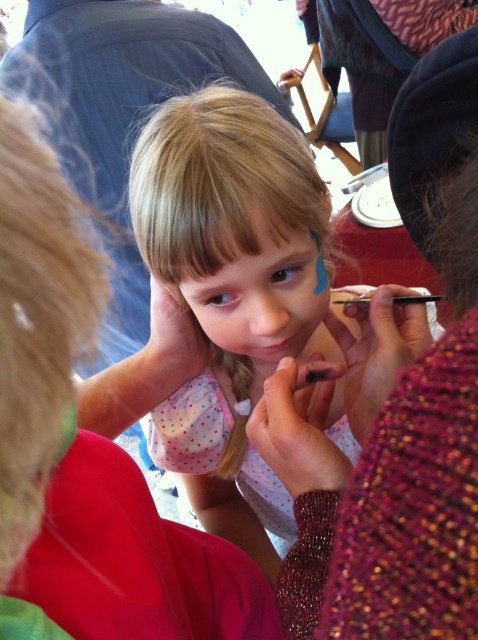
Question: Is pastel polka dot dress at center smaller than smooth skin face at center?

Choices:
 (A) no
 (B) yes

Answer: (A)

Question: Which point appears closest to the camera in this image?

Choices:
 (A) click(x=184, y=273)
 (B) click(x=262, y=349)

Answer: (A)

Question: Which is farther from the pastel polka dot dress at center?

Choices:
 (A) smooth skin face at center
 (B) smooth skin tone hand at center

Answer: (B)

Question: Does smooth skin tone hand at center appear under smooth skin face at center?

Choices:
 (A) no
 (B) yes

Answer: (A)

Question: Which object is farther from the camera taking this photo?

Choices:
 (A) pastel polka dot dress at center
 (B) smooth skin face at center

Answer: (B)

Question: Considering the relative positions of pastel polka dot dress at center and smooth skin tone hand at center in the image provided, where is pastel polka dot dress at center located with respect to smooth skin tone hand at center?

Choices:
 (A) right
 (B) left

Answer: (A)